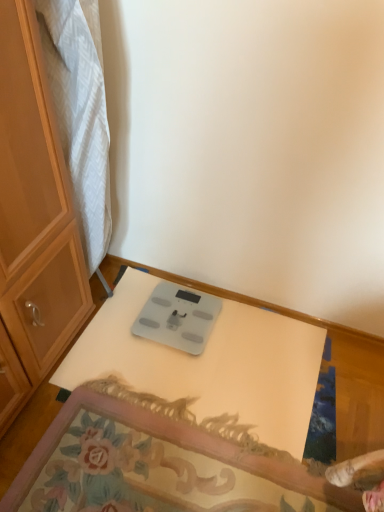
At what (x,y) coordinates should I click in order to perform the action: click on vacant region under matte wood cabinet at left (from a real-world perspective). Please return your answer as a coordinate pair (x, y). Looking at the image, I should click on (114, 281).